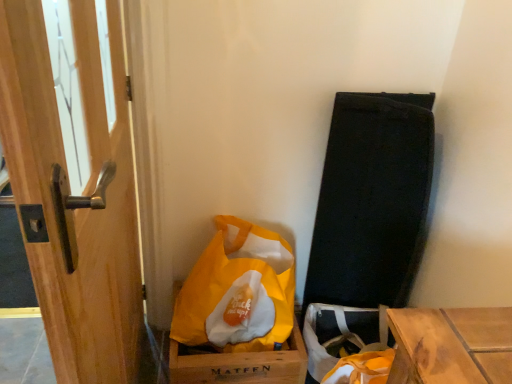
Question: Considering the positions of point (227, 254) and point (229, 377), is point (227, 254) closer or farther from the camera than point (229, 377)?

Choices:
 (A) farther
 (B) closer

Answer: (A)

Question: Relative to yellow matte cardboard box at lower center, is yellow fabric bag at lower center in front or behind?

Choices:
 (A) behind
 (B) front

Answer: (B)

Question: Which is farther from the wooden door handle at left?

Choices:
 (A) yellow matte cardboard box at lower center
 (B) yellow fabric bag at lower center

Answer: (A)

Question: Which is farther from the wooden door handle at left?

Choices:
 (A) yellow fabric bag at lower center
 (B) yellow matte cardboard box at lower center

Answer: (B)